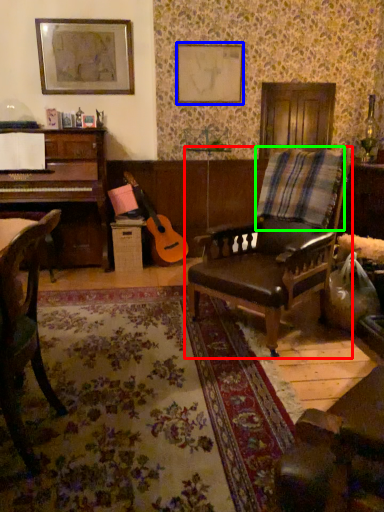
Question: Estimate the real-world distances between objects in this image. Which object is farther from chair (highlighted by a red box), picture frame (highlighted by a blue box) or plaid (highlighted by a green box)?

Choices:
 (A) picture frame
 (B) plaid

Answer: (A)